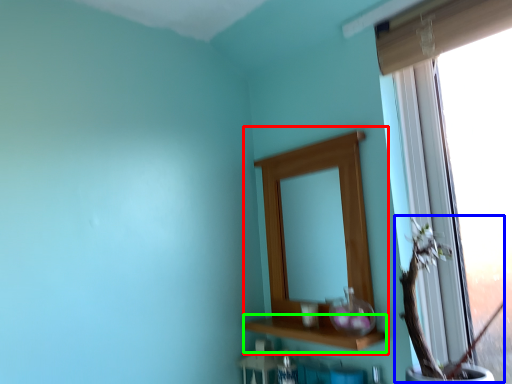
Question: Which is farther away from medicine cabinet (highlighted by a red box)? floral arrangement (highlighted by a blue box) or window sill (highlighted by a green box)?

Choices:
 (A) floral arrangement
 (B) window sill

Answer: (A)